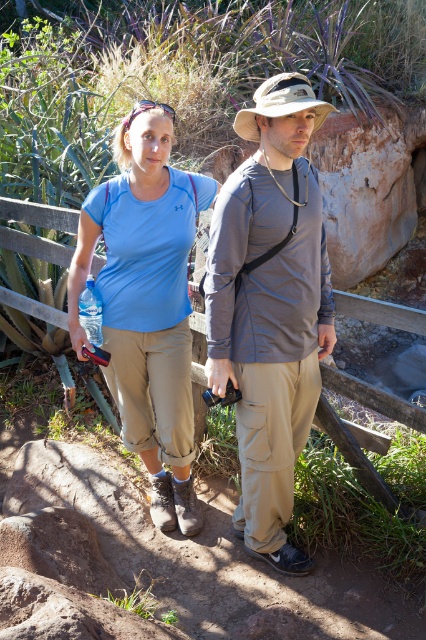
Based on the photo, does matte blue shirt at center have a greater height compared to gray fabric shirt at center?

No, matte blue shirt at center is not taller than gray fabric shirt at center.

Image resolution: width=426 pixels, height=640 pixels. What do you see at coordinates (270, 307) in the screenshot? I see `matte blue shirt at center` at bounding box center [270, 307].

In the scene shown: Who is more distant from viewer, (149, 243) or (279, 77)?

Point (149, 243)

What are the coordinates of `matte blue shirt at center` in the screenshot? It's located at (270, 307).

Who is shorter, gray fabric shirt at center or matte blue t-shirt at center?

matte blue t-shirt at center

What do you see at coordinates (270, 307) in the screenshot? The image size is (426, 640). I see `gray fabric shirt at center` at bounding box center [270, 307].

Where is `gray fabric shirt at center`? Image resolution: width=426 pixels, height=640 pixels. gray fabric shirt at center is located at coordinates (270, 307).

Between matte blue t-shirt at center and tan fabric hat at center, which one is positioned higher?

tan fabric hat at center is above.

Does matte blue t-shirt at center appear on the left side of tan fabric hat at center?

Indeed, matte blue t-shirt at center is positioned on the left side of tan fabric hat at center.

Between point (173, 192) and point (273, 81), which one is positioned in front?

Point (273, 81) is more forward.

The width and height of the screenshot is (426, 640). I want to click on matte blue t-shirt at center, so click(146, 301).